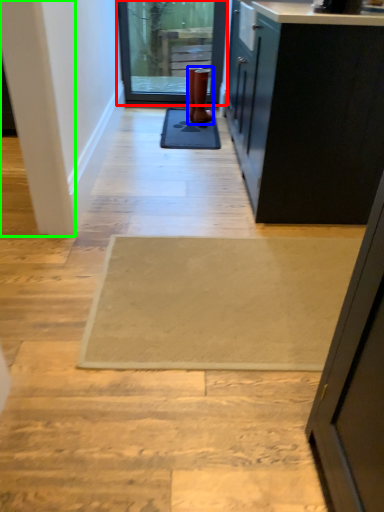
Question: Which object is the farthest from door (highlighted by a red box)? Choose among these: boot (highlighted by a blue box) or pillar (highlighted by a green box).

Choices:
 (A) boot
 (B) pillar

Answer: (B)